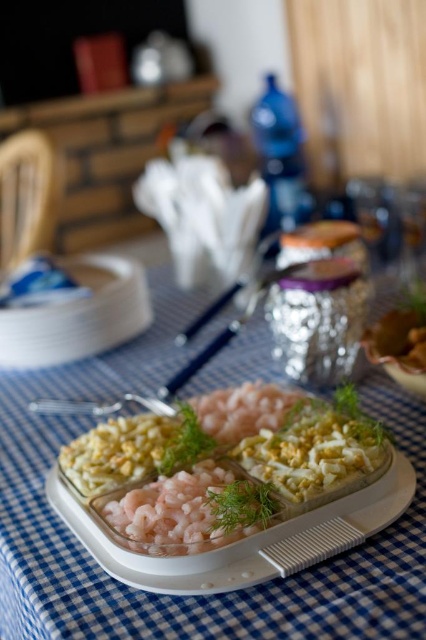
Describe the element at coordinates (186, 596) in the screenshot. I see `blue checkered tablecloth at center` at that location.

Which is more to the right, blue checkered tablecloth at center or white glossy appetizer at center?

From the viewer's perspective, white glossy appetizer at center appears more on the right side.

Measure the distance between blue checkered tablecloth at center and camera.

A distance of 15.50 inches exists between blue checkered tablecloth at center and camera.

This screenshot has width=426, height=640. What are the coordinates of `blue checkered tablecloth at center` in the screenshot? It's located at (186, 596).

Does blue checkered tablecloth at center appear under pink translucent shrimp at center?

Incorrect, blue checkered tablecloth at center is not positioned below pink translucent shrimp at center.

Does blue checkered tablecloth at center come behind pink translucent shrimp at center?

No, blue checkered tablecloth at center is in front of pink translucent shrimp at center.

This screenshot has width=426, height=640. What do you see at coordinates (186, 596) in the screenshot?
I see `blue checkered tablecloth at center` at bounding box center [186, 596].

The height and width of the screenshot is (640, 426). I want to click on blue checkered tablecloth at center, so click(x=186, y=596).

Is blue checkered tablecloth at center shorter than white creamy pasta at center?

In fact, blue checkered tablecloth at center may be taller than white creamy pasta at center.

Does blue checkered tablecloth at center have a greater height compared to white creamy pasta at center?

Indeed, blue checkered tablecloth at center has a greater height compared to white creamy pasta at center.

What do you see at coordinates (186, 596) in the screenshot? The width and height of the screenshot is (426, 640). I see `blue checkered tablecloth at center` at bounding box center [186, 596].

Find the location of `blue checkered tablecloth at center`. blue checkered tablecloth at center is located at coordinates (186, 596).